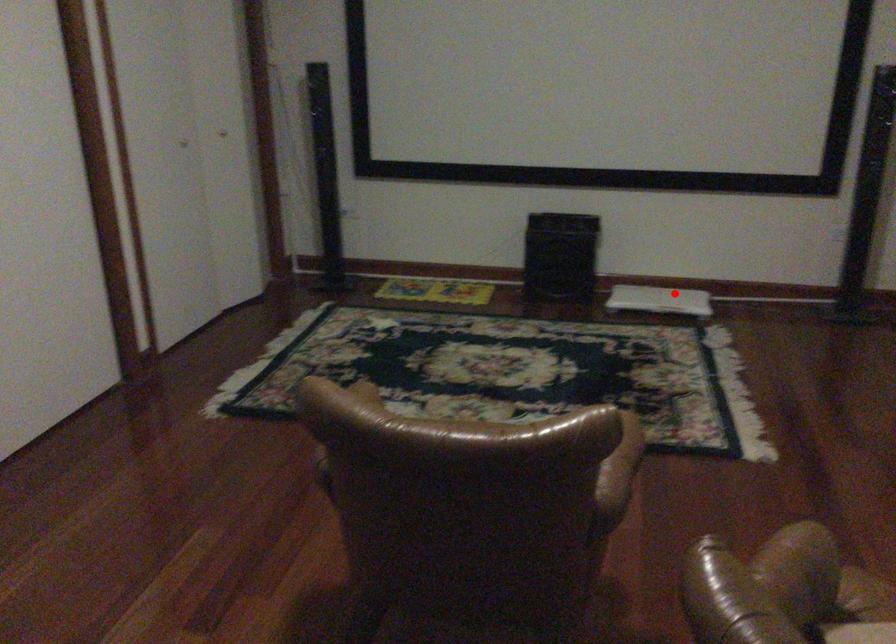
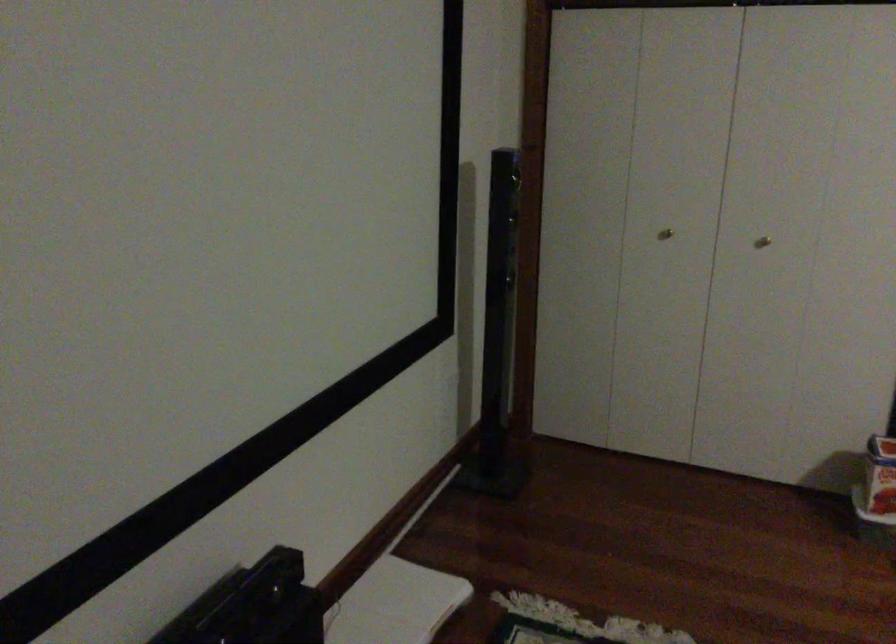
Find the pixel in the second image that matches the highlighted location in the first image.

(394, 603)